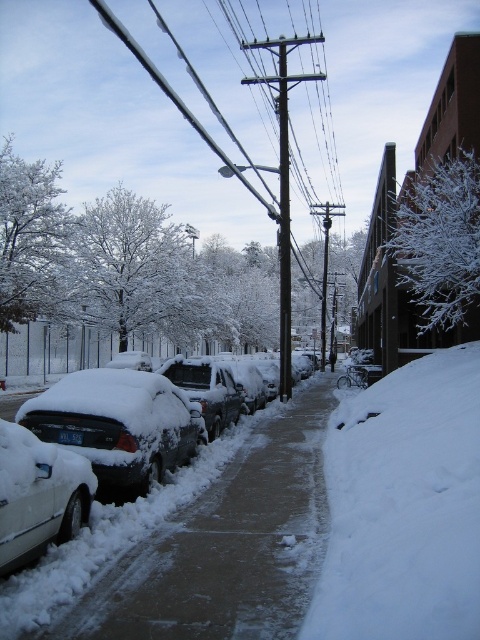
Question: Does white frosty tree at center-right appear on the left side of smooth black pole at center?

Choices:
 (A) yes
 (B) no

Answer: (B)

Question: Which of these objects is positioned closest to the smooth black pole at center?

Choices:
 (A) white frosty tree at center-right
 (B) white snow-covered sidewalk at center

Answer: (A)

Question: Considering the relative positions of white snow-covered sidewalk at center and smooth black pole at center in the image provided, where is white snow-covered sidewalk at center located with respect to smooth black pole at center?

Choices:
 (A) above
 (B) below

Answer: (B)

Question: Can you confirm if white snow-covered sidewalk at center is smaller than smooth black pole at center?

Choices:
 (A) no
 (B) yes

Answer: (B)

Question: Which point is closer to the camera?

Choices:
 (A) (464, 204)
 (B) (315, 381)
 (C) (285, 193)

Answer: (A)

Question: Which object appears farthest from the camera in this image?

Choices:
 (A) white snow-covered sidewalk at center
 (B) white frosty tree at center-right
 (C) smooth black pole at center

Answer: (C)